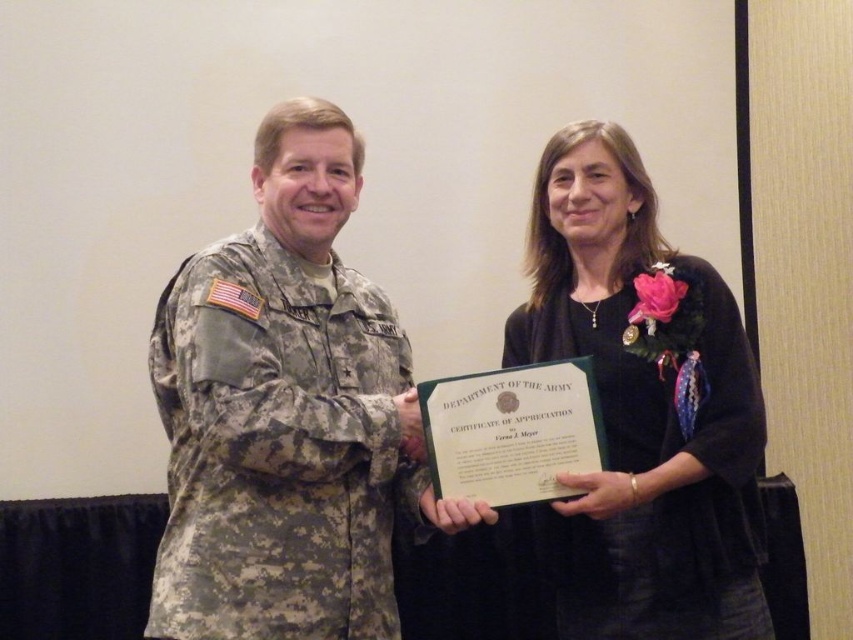
Question: Can you confirm if camouflage uniform at center is thinner than matte black uniform at center?

Choices:
 (A) no
 (B) yes

Answer: (A)

Question: Which of the following is the farthest from the observer?

Choices:
 (A) (709, 492)
 (B) (206, 378)

Answer: (A)

Question: Does camouflage uniform at center appear on the left side of matte black uniform at center?

Choices:
 (A) yes
 (B) no

Answer: (A)

Question: Which of the following is the farthest from the observer?

Choices:
 (A) matte black uniform at center
 (B) camouflage uniform at center

Answer: (A)

Question: Is camouflage uniform at center to the right of matte black uniform at center from the viewer's perspective?

Choices:
 (A) no
 (B) yes

Answer: (A)